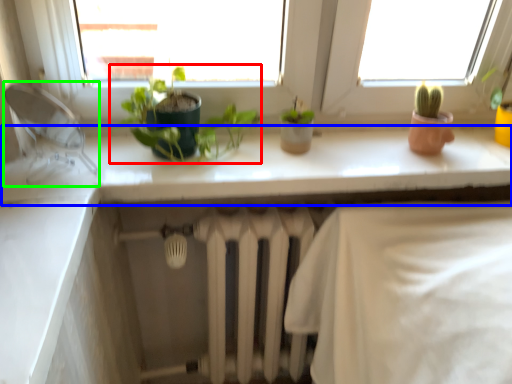
Question: Estimate the real-world distances between objects in this image. Which object is closer to houseplant (highlighted by a red box), counter top (highlighted by a blue box) or faucet (highlighted by a green box)?

Choices:
 (A) counter top
 (B) faucet

Answer: (A)